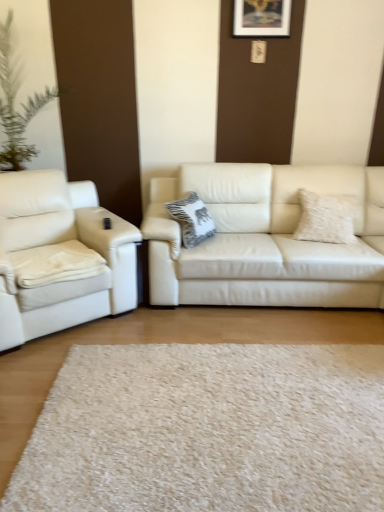
Question: Could fuzzy white pillow at right, acting as the second pillow starting from the left, be considered to be inside wooden picture frame at upper center?

Choices:
 (A) yes
 (B) no

Answer: (B)

Question: Does wooden picture frame at upper center have a lesser width compared to fuzzy white pillow at right, the first pillow positioned from the right?

Choices:
 (A) no
 (B) yes

Answer: (B)

Question: From the image's perspective, would you say wooden picture frame at upper center is positioned over fuzzy white pillow at right, the first pillow positioned from the right?

Choices:
 (A) yes
 (B) no

Answer: (A)

Question: Does wooden picture frame at upper center turn towards fuzzy white pillow at right, acting as the second pillow starting from the left?

Choices:
 (A) no
 (B) yes

Answer: (A)

Question: Is wooden picture frame at upper center far away from fuzzy white pillow at right, the first pillow positioned from the right?

Choices:
 (A) no
 (B) yes

Answer: (B)

Question: Is matte white couch at center, acting as the second studio couch starting from the left, bigger or smaller than white shag rug at center?

Choices:
 (A) small
 (B) big

Answer: (B)

Question: From a real-world perspective, is matte white couch at center, acting as the first studio couch starting from the right, physically located above or below white shag rug at center?

Choices:
 (A) above
 (B) below

Answer: (A)

Question: Do you think matte white couch at center, acting as the first studio couch starting from the right, is within white shag rug at center, or outside of it?

Choices:
 (A) outside
 (B) inside

Answer: (A)

Question: Would you say matte white couch at center, acting as the second studio couch starting from the left, is to the left or to the right of white shag rug at center in the picture?

Choices:
 (A) right
 (B) left

Answer: (A)

Question: From a real-world perspective, is white textured pillow at center, the 1th pillow when ordered from left to right, positioned above or below white shag rug at center?

Choices:
 (A) above
 (B) below

Answer: (A)

Question: Is point (196, 226) closer or farther from the camera than point (304, 493)?

Choices:
 (A) farther
 (B) closer

Answer: (A)

Question: Considering their positions, is white textured pillow at center, the 1th pillow when ordered from left to right, located in front of or behind white shag rug at center?

Choices:
 (A) front
 (B) behind

Answer: (B)

Question: Is white textured pillow at center, the 1th pillow when ordered from left to right, taller or shorter than white shag rug at center?

Choices:
 (A) tall
 (B) short

Answer: (A)

Question: Relative to wooden picture frame at upper center, is white shag rug at center in front or behind?

Choices:
 (A) front
 (B) behind

Answer: (A)

Question: From the image's perspective, is white shag rug at center above or below wooden picture frame at upper center?

Choices:
 (A) below
 (B) above

Answer: (A)